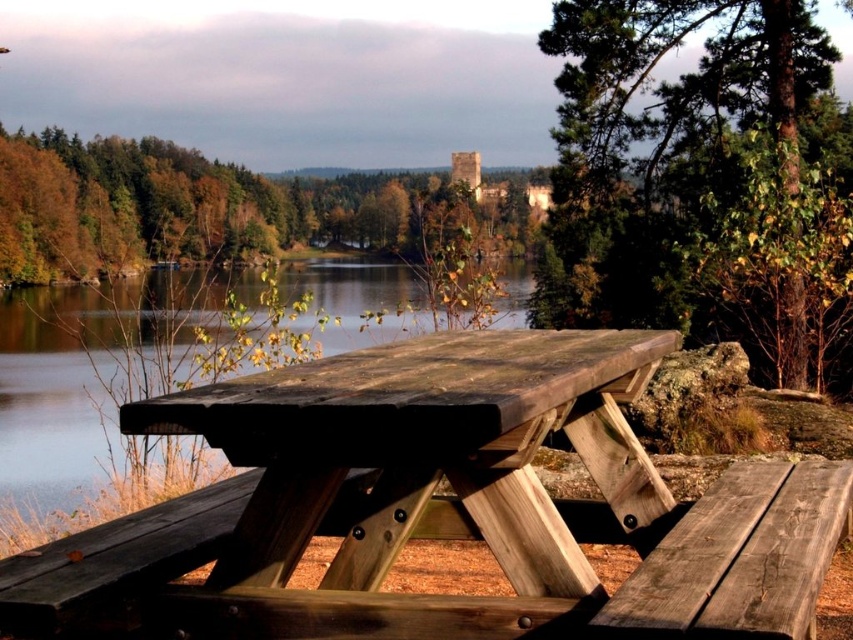
Is point (35, 307) positioned in front of point (241, 205)?

That is True.

Where is `brown wooden lake at center`? The image size is (853, 640). brown wooden lake at center is located at coordinates (79, 385).

Where is `brown wooden lake at center`? brown wooden lake at center is located at coordinates (79, 385).

Image resolution: width=853 pixels, height=640 pixels. I want to click on brown wooden lake at center, so click(x=79, y=385).

Does weathered wood picnic table at center have a smaller size compared to brown wooden lake at center?

Indeed, weathered wood picnic table at center has a smaller size compared to brown wooden lake at center.

Locate an element on the screen. weathered wood picnic table at center is located at coordinates (x=427, y=452).

Identify the location of weathered wood picnic table at center. (427, 452).

In the scene shown: Does weathered wood picnic table at center appear on the left side of green rough bark tree at upper right?

Correct, you'll find weathered wood picnic table at center to the left of green rough bark tree at upper right.

Is weathered wood picnic table at center thinner than green rough bark tree at upper right?

Yes, weathered wood picnic table at center is thinner than green rough bark tree at upper right.

The width and height of the screenshot is (853, 640). What do you see at coordinates (427, 452) in the screenshot?
I see `weathered wood picnic table at center` at bounding box center [427, 452].

Where is `weathered wood picnic table at center`? weathered wood picnic table at center is located at coordinates (427, 452).